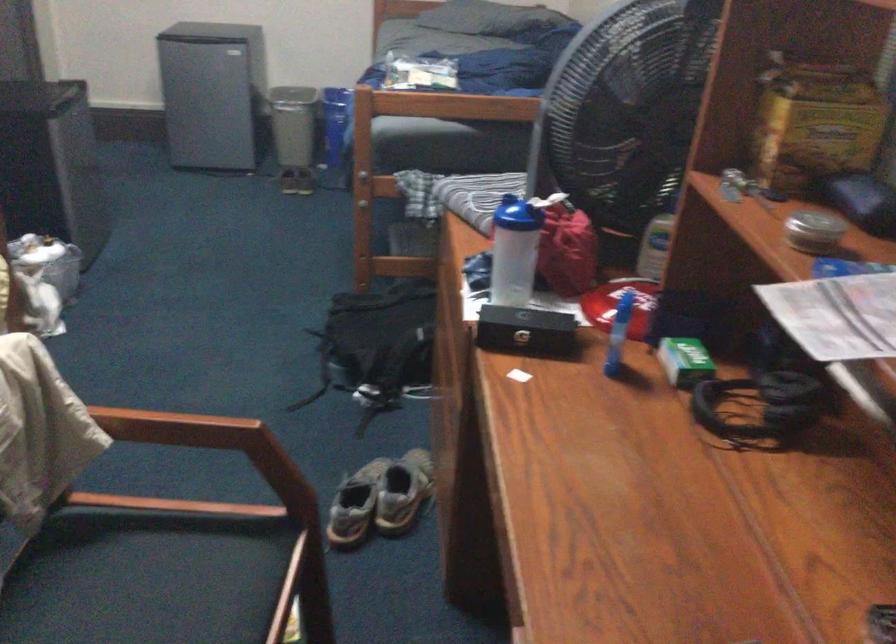
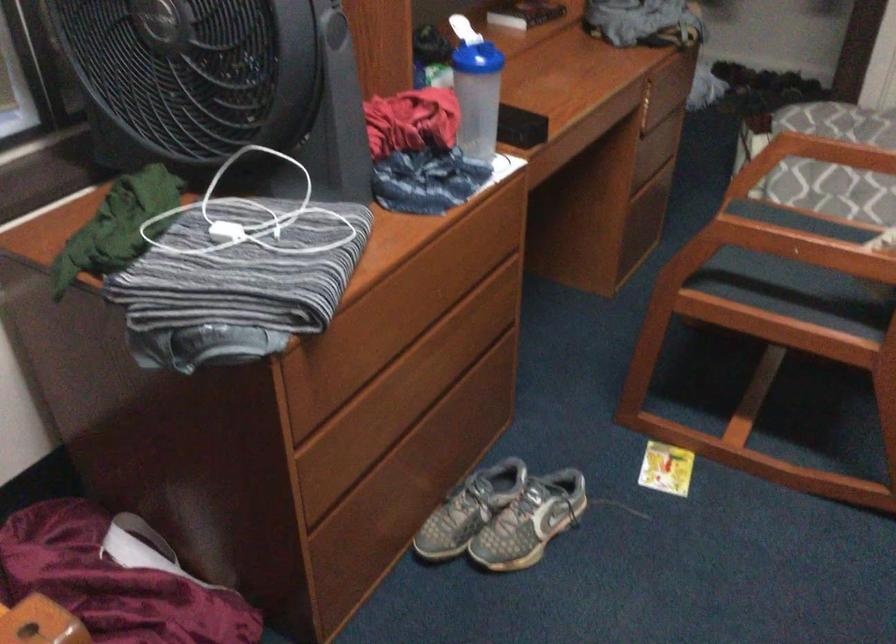
The point at (185, 426) is marked in the first image. Where is the corresponding point in the second image?

(790, 245)